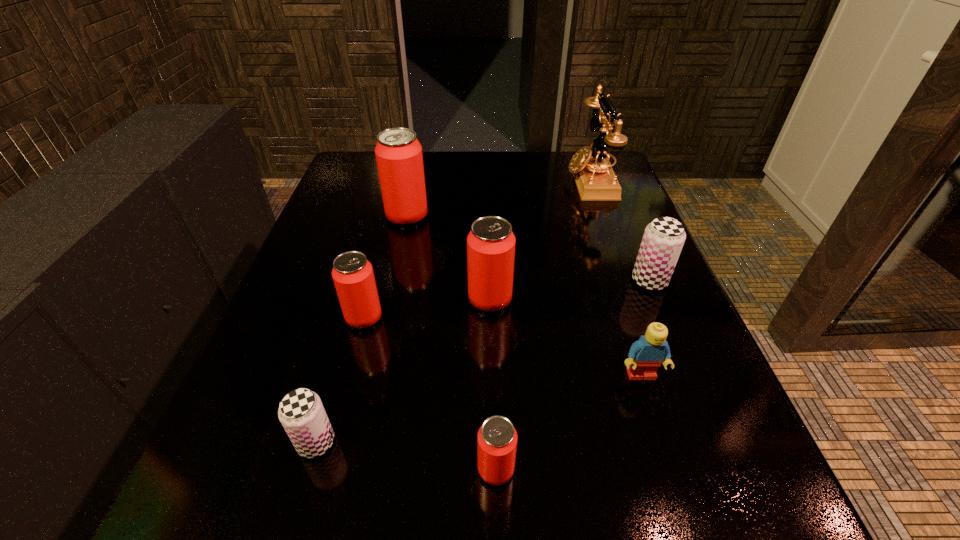
Find the location of a particular element. This screenshot has height=540, width=960. beige telephone is located at coordinates (596, 181).

This screenshot has width=960, height=540. Identify the location of the farthest red beer can. (399, 158).

Identify the location of the biggest red beer can. The height and width of the screenshot is (540, 960). (399, 158).

You are a GUI agent. You are given a task and a screenshot of the screen. Output one action in this format:
    pyautogui.click(x=<x>, y=<y>)
    Task: Click on the fifth shortest beer can
    This screenshot has height=540, width=960.
    Given the screenshot: What is the action you would take?
    point(491,243)

Image resolution: width=960 pixels, height=540 pixels. I want to click on the third tallest object, so click(491, 243).

Where is `the bigger purple beer can`? This screenshot has height=540, width=960. the bigger purple beer can is located at coordinates (663, 239).

Find the location of `the right purple beer can`. the right purple beer can is located at coordinates (663, 239).

Locate an element on the screen. the third biggest red beer can is located at coordinates (352, 273).

At what (x,y) coordinates should I click in order to perform the action: click on the sixth farthest object. Please return your answer as a coordinate pair (x, y). The height and width of the screenshot is (540, 960). Looking at the image, I should click on (645, 356).

This screenshot has width=960, height=540. In order to click on Lego in this screenshot , I will do `click(645, 356)`.